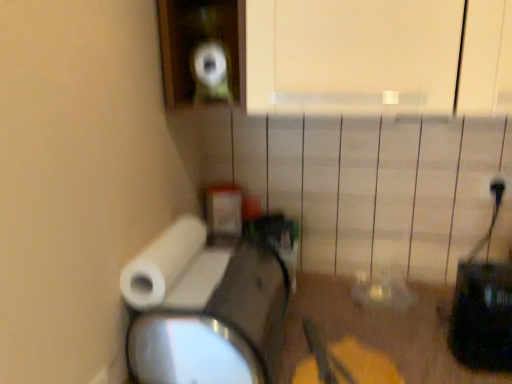
Where is `vacant area that lies to the right of white matte toilet paper at lower left`? vacant area that lies to the right of white matte toilet paper at lower left is located at coordinates (214, 274).